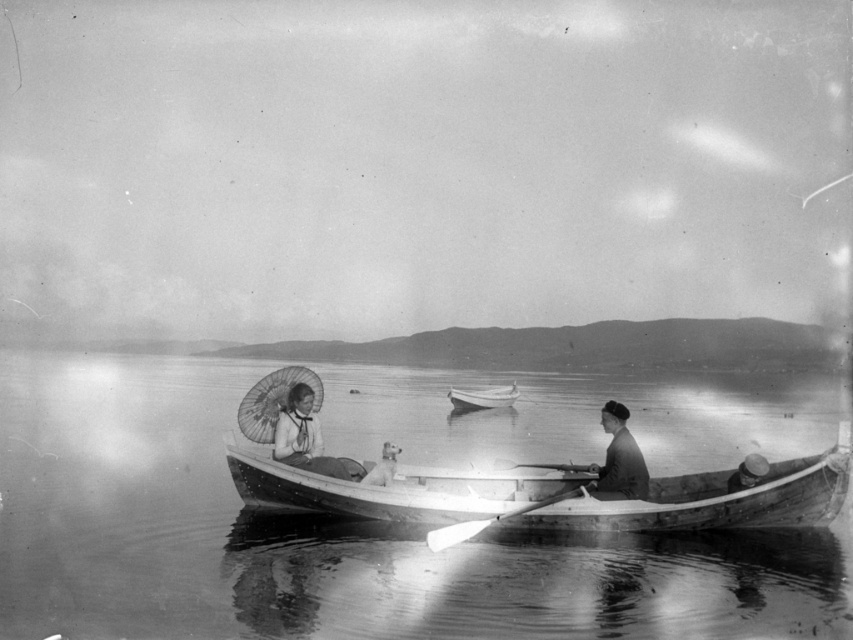
Question: Which of the following is the closest to the observer?

Choices:
 (A) smooth wooden boat at center
 (B) wooden smooth paddle at center
 (C) white wood paddle at center
 (D) smooth silk parasol at center

Answer: (C)

Question: Where is wooden canoe at center located in relation to translucent paper umbrella at left in the image?

Choices:
 (A) above
 (B) below

Answer: (B)

Question: Can you confirm if clear water at boat center is smaller than white wood paddle at center?

Choices:
 (A) no
 (B) yes

Answer: (A)

Question: Which point is farther to the camera?

Choices:
 (A) (554, 493)
 (B) (300, 388)
 (C) (569, 468)

Answer: (C)

Question: Which point appears closest to the camera in this image?

Choices:
 (A) (294, 465)
 (B) (393, 474)
 (C) (549, 468)
 (D) (242, 404)

Answer: (B)

Question: Is smooth dark fabric cap at center to the right of wooden smooth paddle at center from the viewer's perspective?

Choices:
 (A) yes
 (B) no

Answer: (A)